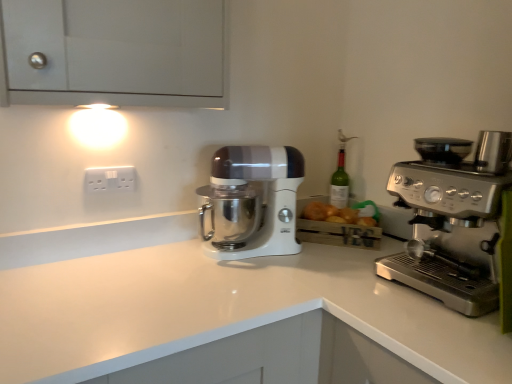
The width and height of the screenshot is (512, 384). I want to click on satin silver espresso machine at right, so click(457, 223).

In the scene shown: Measure the distance between satin silver espresso machine at right and camera.

satin silver espresso machine at right and camera are 36.02 inches apart from each other.

What do you see at coordinates (223, 311) in the screenshot? I see `white glossy countertop at center` at bounding box center [223, 311].

Find the location of a particular element. Image resolution: width=512 pixels, height=384 pixels. white glossy stand mixer at center is located at coordinates (251, 202).

The image size is (512, 384). I want to click on white plastic electrical outlet at upper left, so click(110, 179).

Does white glossy stand mixer at center have a lesser width compared to white glossy countertop at center?

Yes.

Considering the relative positions of white glossy stand mixer at center and white glossy countertop at center in the image provided, is white glossy stand mixer at center behind white glossy countertop at center?

Yes, white glossy stand mixer at center is further from the camera.

From a real-world perspective, which is physically above, white glossy stand mixer at center or white glossy countertop at center?

From a 3D spatial view, white glossy stand mixer at center is above.

Who is smaller, satin silver espresso machine at right or white glossy countertop at center?

satin silver espresso machine at right is smaller.

Could you tell me if satin silver espresso machine at right is facing white glossy countertop at center?

No, satin silver espresso machine at right does not turn towards white glossy countertop at center.

From the image's perspective, is satin silver espresso machine at right located above or below white glossy countertop at center?

Based on their image positions, satin silver espresso machine at right is located above white glossy countertop at center.

Considering the sizes of objects satin silver espresso machine at right and white glossy countertop at center in the image provided, who is wider, satin silver espresso machine at right or white glossy countertop at center?

With larger width is white glossy countertop at center.

Which object is wider, white plastic electrical outlet at upper left or white glossy countertop at center?

white glossy countertop at center.

From the image's perspective, is white plastic electrical outlet at upper left located above white glossy countertop at center?

Yes, from the image's perspective, white plastic electrical outlet at upper left is over white glossy countertop at center.

Is white plastic electrical outlet at upper left next to white glossy countertop at center?

white plastic electrical outlet at upper left and white glossy countertop at center are clearly separated.

Considering the sizes of white plastic electrical outlet at upper left and white glossy countertop at center in the image, is white plastic electrical outlet at upper left taller or shorter than white glossy countertop at center?

Considering their sizes, white plastic electrical outlet at upper left has less height than white glossy countertop at center.

From a real-world perspective, is white glossy stand mixer at center on white plastic electrical outlet at upper left?

No, from a real-world perspective, white glossy stand mixer at center is not on top of white plastic electrical outlet at upper left.

Who is shorter, white glossy stand mixer at center or white plastic electrical outlet at upper left?

Standing shorter between the two is white plastic electrical outlet at upper left.

Considering the sizes of objects white glossy stand mixer at center and white plastic electrical outlet at upper left in the image provided, who is wider, white glossy stand mixer at center or white plastic electrical outlet at upper left?

Wider between the two is white glossy stand mixer at center.

Is white glossy countertop at center positioned beyond the bounds of white matte cabinet at upper left?

That's correct, white glossy countertop at center is outside of white matte cabinet at upper left.

From a real-world perspective, is white glossy countertop at center positioned above or below white matte cabinet at upper left?

In terms of real-world spatial position, white glossy countertop at center is below white matte cabinet at upper left.

Does white glossy countertop at center have a larger size compared to white matte cabinet at upper left?

Yes, white glossy countertop at center is bigger than white matte cabinet at upper left.

Consider the image. Is satin silver espresso machine at right positioned far away from white plastic electrical outlet at upper left?

No, satin silver espresso machine at right is not far from white plastic electrical outlet at upper left.

From the image's perspective, is satin silver espresso machine at right on top of white plastic electrical outlet at upper left?

Actually, satin silver espresso machine at right appears below white plastic electrical outlet at upper left in the image.

Where is `electric outlet behind the satin silver espresso machine at right`? electric outlet behind the satin silver espresso machine at right is located at coordinates pos(110,179).

From a real-world perspective, which is physically above, satin silver espresso machine at right or white plastic electrical outlet at upper left?

white plastic electrical outlet at upper left, from a real-world perspective.

Considering the relative positions of white matte cabinet at upper left and white plastic electrical outlet at upper left in the image provided, is white matte cabinet at upper left to the right of white plastic electrical outlet at upper left from the viewer's perspective?

Correct, you'll find white matte cabinet at upper left to the right of white plastic electrical outlet at upper left.

From a real-world perspective, which object rests below the other?

white plastic electrical outlet at upper left, from a real-world perspective.

Is white matte cabinet at upper left smaller than white plastic electrical outlet at upper left?

Actually, white matte cabinet at upper left might be larger than white plastic electrical outlet at upper left.

Does white matte cabinet at upper left turn towards white plastic electrical outlet at upper left?

No.

Where is `mixer lying on the left of white glossy countertop at center`? mixer lying on the left of white glossy countertop at center is located at coordinates (251, 202).

At what (x,y) coordinates should I click in order to perform the action: click on coffee maker lying on the right of white glossy countertop at center. Please return your answer as a coordinate pair (x, y). Looking at the image, I should click on (457, 223).

Looking at the image, which one is located closer to white glossy stand mixer at center, satin silver espresso machine at right or white plastic electrical outlet at upper left?

Based on the image, white plastic electrical outlet at upper left appears to be nearer to white glossy stand mixer at center.

From the image, which object appears to be nearer to white plastic electrical outlet at upper left, satin silver espresso machine at right or white glossy stand mixer at center?

white glossy stand mixer at center is closer to white plastic electrical outlet at upper left.

Which object lies further to the anchor point white matte cabinet at upper left, white plastic electrical outlet at upper left or white glossy stand mixer at center?

The object further to white matte cabinet at upper left is white plastic electrical outlet at upper left.

When comparing their distances from white plastic electrical outlet at upper left, does white glossy countertop at center or satin silver espresso machine at right seem further?

The object further to white plastic electrical outlet at upper left is satin silver espresso machine at right.

From the image, which object appears to be farther from white plastic electrical outlet at upper left, satin silver espresso machine at right or white glossy countertop at center?

Among the two, satin silver espresso machine at right is located further to white plastic electrical outlet at upper left.

Based on their spatial positions, is white plastic electrical outlet at upper left or white glossy stand mixer at center further from white glossy countertop at center?

Based on the image, white plastic electrical outlet at upper left appears to be further to white glossy countertop at center.

Looking at the image, which one is located closer to satin silver espresso machine at right, white matte cabinet at upper left or white plastic electrical outlet at upper left?

The object closer to satin silver espresso machine at right is white matte cabinet at upper left.

Estimate the real-world distances between objects in this image. Which object is closer to white glossy stand mixer at center, white matte cabinet at upper left or white plastic electrical outlet at upper left?

white plastic electrical outlet at upper left is positioned closer to the anchor white glossy stand mixer at center.

I want to click on mixer positioned between white matte cabinet at upper left and white plastic electrical outlet at upper left from near to far, so click(251, 202).

At what (x,y) coordinates should I click in order to perform the action: click on coffee maker between white glossy stand mixer at center and white glossy countertop at center from top to bottom. Please return your answer as a coordinate pair (x, y). Looking at the image, I should click on (457, 223).

Identify the location of counter top located between white plastic electrical outlet at upper left and satin silver espresso machine at right in the left-right direction. The height and width of the screenshot is (384, 512). (223, 311).

Identify the location of coffee maker between white matte cabinet at upper left and white glossy countertop at center vertically. The width and height of the screenshot is (512, 384). (457, 223).